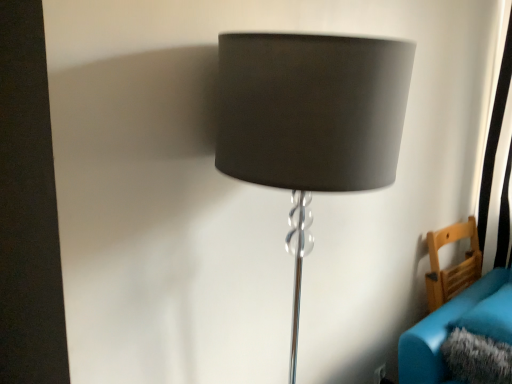
Question: Does wooden chair at lower right have a lesser width compared to matte gray lampshade at center?

Choices:
 (A) yes
 (B) no

Answer: (A)

Question: Is wooden chair at lower right smaller than matte gray lampshade at center?

Choices:
 (A) no
 (B) yes

Answer: (B)

Question: Does wooden chair at lower right have a greater height compared to matte gray lampshade at center?

Choices:
 (A) yes
 (B) no

Answer: (B)

Question: Can you confirm if wooden chair at lower right is positioned to the right of matte gray lampshade at center?

Choices:
 (A) no
 (B) yes

Answer: (B)

Question: Is matte gray lampshade at center at the back of wooden chair at lower right?

Choices:
 (A) yes
 (B) no

Answer: (B)

Question: Is wooden chair at lower right wider than matte gray lampshade at center?

Choices:
 (A) yes
 (B) no

Answer: (B)

Question: Does matte gray lampshade at center lie behind velvet teal couch at lower right?

Choices:
 (A) yes
 (B) no

Answer: (B)

Question: Is matte gray lampshade at center beside velvet teal couch at lower right?

Choices:
 (A) yes
 (B) no

Answer: (B)

Question: Is matte gray lampshade at center to the right of velvet teal couch at lower right from the viewer's perspective?

Choices:
 (A) no
 (B) yes

Answer: (A)

Question: Is matte gray lampshade at center smaller than velvet teal couch at lower right?

Choices:
 (A) no
 (B) yes

Answer: (A)

Question: Could velvet teal couch at lower right be considered to be inside matte gray lampshade at center?

Choices:
 (A) yes
 (B) no

Answer: (B)

Question: Is matte gray lampshade at center facing towards velvet teal couch at lower right?

Choices:
 (A) yes
 (B) no

Answer: (B)

Question: Considering the relative sizes of velvet teal couch at lower right and wooden chair at lower right in the image provided, is velvet teal couch at lower right thinner than wooden chair at lower right?

Choices:
 (A) yes
 (B) no

Answer: (B)